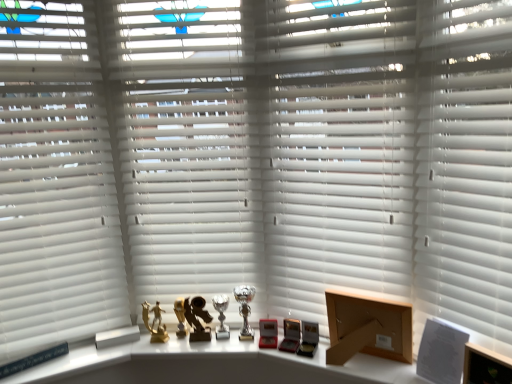
The width and height of the screenshot is (512, 384). Identify the location of vacant space to the left of gold metallic trophy at center. (139, 346).